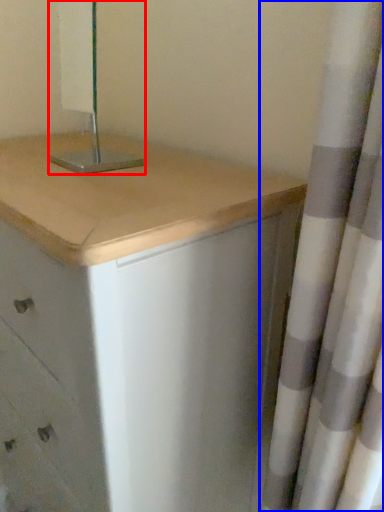
Question: Which object is further to the camera taking this photo, bedside lamp (highlighted by a red box) or curtain (highlighted by a blue box)?

Choices:
 (A) bedside lamp
 (B) curtain

Answer: (A)